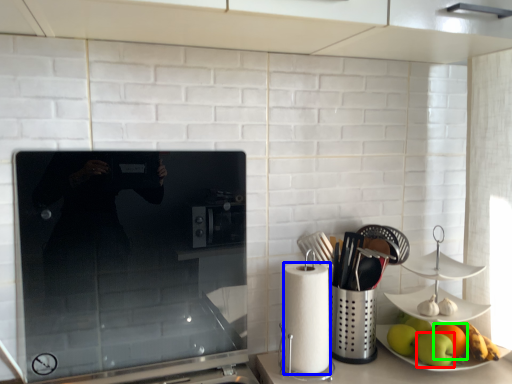
Question: Based on their relative distances, which object is farther from apple (highlighted by a red box)? Choose from paper towel (highlighted by a blue box) and orange (highlighted by a green box).

Choices:
 (A) paper towel
 (B) orange

Answer: (A)